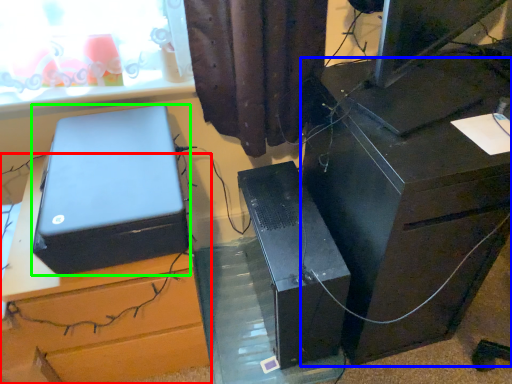
Question: Estimate the real-world distances between objects in this image. Which object is closer to furniture (highlighted by a red box), furniture (highlighted by a blue box) or box (highlighted by a green box)?

Choices:
 (A) furniture
 (B) box

Answer: (B)